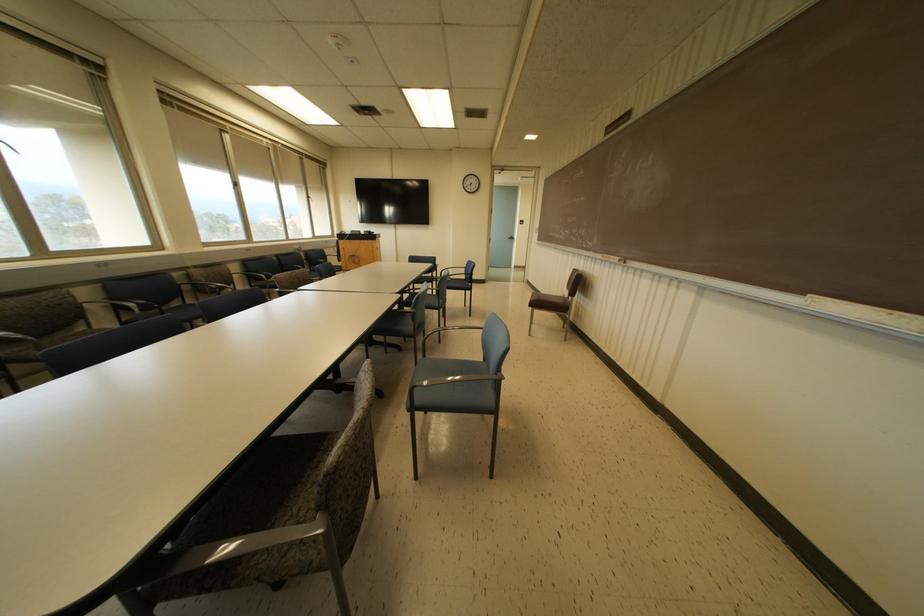
The width and height of the screenshot is (924, 616). Identify the location of patterned chair sitting surface. (277, 472).